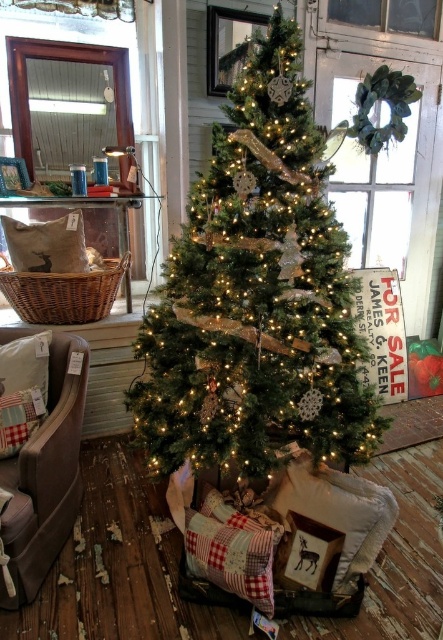
You are standing in the center of the room and want to place a gift under the green matte Christmas tree at center. Based on the coordinates provided, in which direction should you move to reach the tree?

The green matte Christmas tree at center is located at coordinates approximately 0.463 on the x and 0.580 on the y axis. Since you are at the center of the room, which would be coordinates (221, 320), you should move slightly to the left and forward to reach the tree.

You are sitting in the velvet beige armchair at lower left and want to place a gift under the green matte christmas tree at center. Which direction should you move to reach the tree?

The green matte christmas tree at center is above the velvet beige armchair at lower left, so you should move upward or forward to reach the tree.